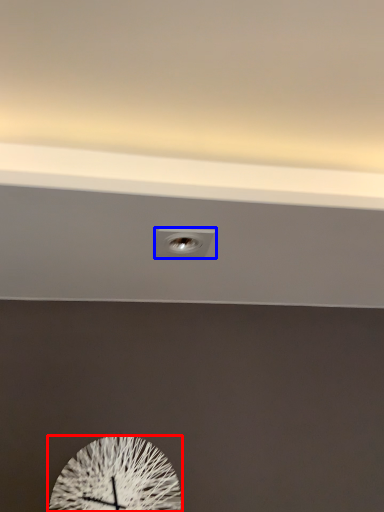
Question: Which object appears closest to the camera in this image, wall clock (highlighted by a red box) or electric outlet (highlighted by a blue box)?

Choices:
 (A) wall clock
 (B) electric outlet

Answer: (B)